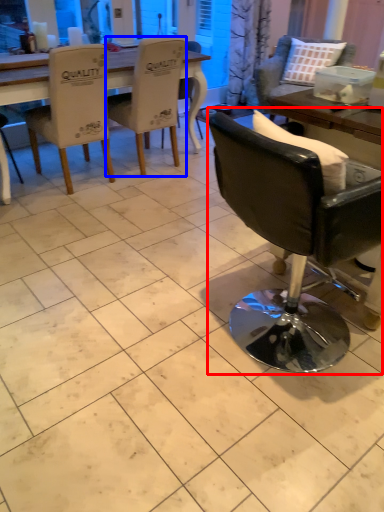
Question: Which object appears farthest to the camera in this image, chair (highlighted by a red box) or chair (highlighted by a blue box)?

Choices:
 (A) chair
 (B) chair

Answer: (B)